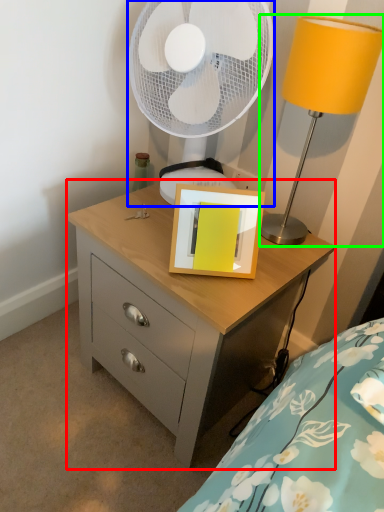
Question: Which is farther away from chest of drawers (highlighted by a red box)? mechanical fan (highlighted by a blue box) or table lamp (highlighted by a green box)?

Choices:
 (A) mechanical fan
 (B) table lamp

Answer: (A)